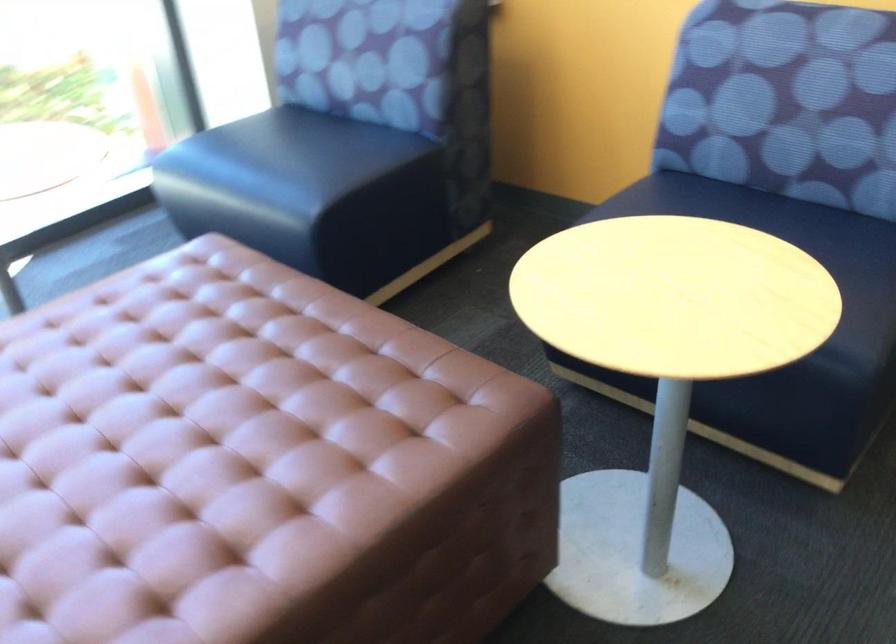
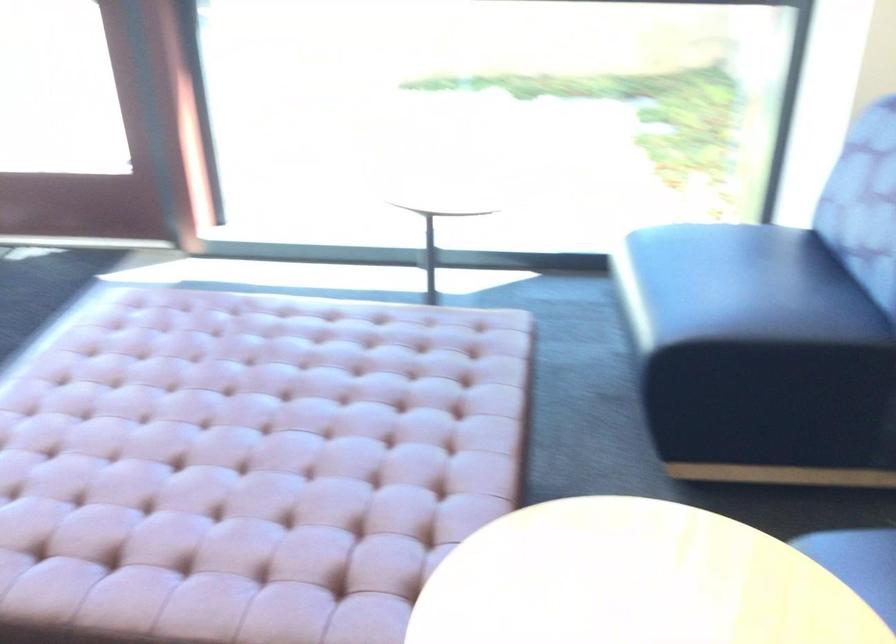
Locate, in the second image, the point that corresponds to (325,162) in the first image.

(724, 301)